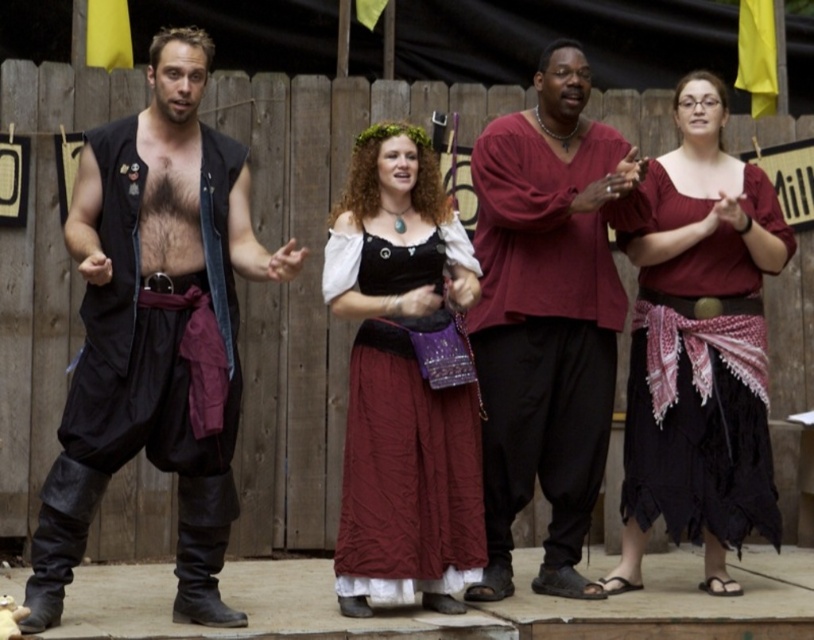
Question: Does maroon fabric shirt at center have a greater width compared to velvet black dress at center?

Choices:
 (A) no
 (B) yes

Answer: (B)

Question: Among these points, which one is farthest from the camera?

Choices:
 (A) (650, 326)
 (B) (90, 157)

Answer: (A)

Question: Is maroon fabric shirt at center to the left of velvet black dress at center from the viewer's perspective?

Choices:
 (A) yes
 (B) no

Answer: (B)

Question: Which of the following is the closest to the observer?

Choices:
 (A) (112, 404)
 (B) (705, 538)
 (C) (427, 456)
 (D) (576, 227)

Answer: (A)

Question: Which of these objects is positioned closest to the matte red blouse at center?

Choices:
 (A) maroon fabric shirt at center
 (B) velvet black dress at center

Answer: (A)

Question: Can you confirm if maroon fabric shirt at center is thinner than matte red blouse at center?

Choices:
 (A) no
 (B) yes

Answer: (B)